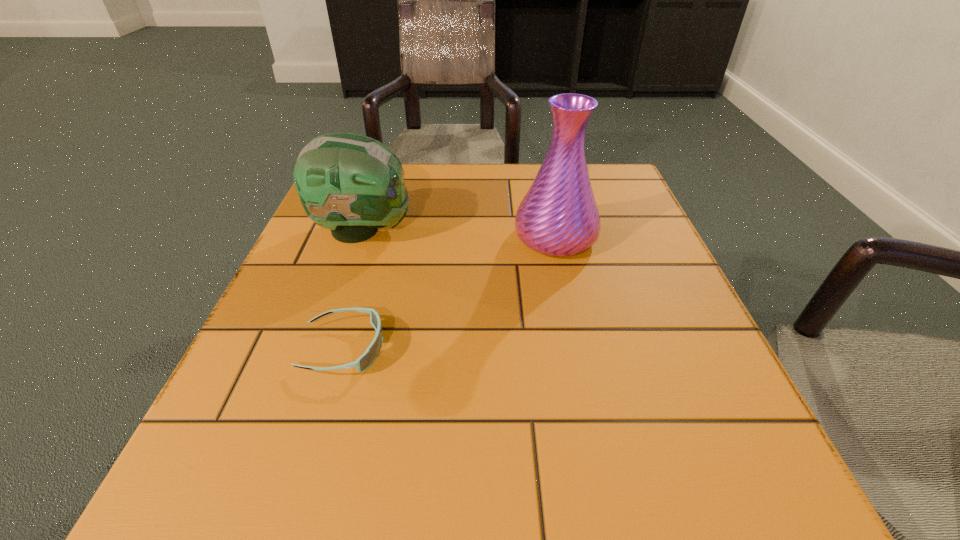
Locate an element on the screen. vacant space in between the football helmet and the vase is located at coordinates (459, 234).

What are the coordinates of `vacant space that's between the goggles and the vase` in the screenshot? It's located at (449, 293).

This screenshot has height=540, width=960. In order to click on vacant space that is in between the football helmet and the vase in this screenshot , I will do `click(459, 234)`.

Image resolution: width=960 pixels, height=540 pixels. In order to click on free space between the second tallest object and the goggles in this screenshot , I will do `click(353, 289)`.

Locate an element on the screen. empty space that is in between the goggles and the rightmost object is located at coordinates (449, 293).

The height and width of the screenshot is (540, 960). What are the coordinates of `unoccupied area between the rightmost object and the shortest object` in the screenshot? It's located at (449, 293).

In order to click on free spot between the shortest object and the tallest object in this screenshot , I will do pos(449,293).

Find the location of a particular element. The width and height of the screenshot is (960, 540). free space between the vase and the goggles is located at coordinates (449, 293).

The height and width of the screenshot is (540, 960). Find the location of `vacant space in between the nearest object and the rightmost object`. vacant space in between the nearest object and the rightmost object is located at coordinates pos(449,293).

Find the location of a particular element. free space between the second shortest object and the nearest object is located at coordinates (353, 289).